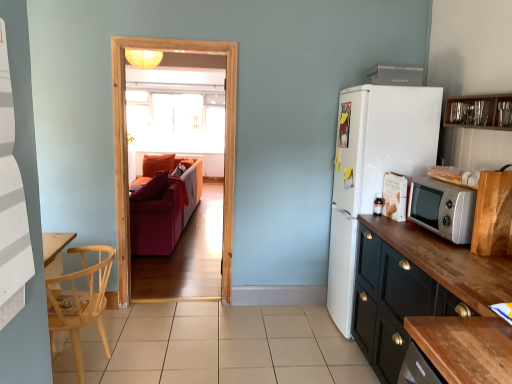
This screenshot has height=384, width=512. I want to click on free spot to the left of wooden cabinet at right, which ranks as the 2th cabinetry in top-to-bottom order, so click(458, 251).